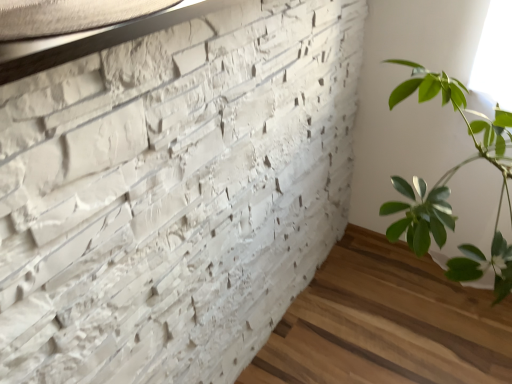
Question: Considering the relative sizes of white textured brickwork at upper left and matte white stone at upper left in the image provided, is white textured brickwork at upper left smaller than matte white stone at upper left?

Choices:
 (A) no
 (B) yes

Answer: (A)

Question: Is matte white stone at upper left surrounded by white textured brickwork at upper left?

Choices:
 (A) yes
 (B) no

Answer: (A)

Question: From a real-world perspective, is white textured brickwork at upper left physically below matte white stone at upper left?

Choices:
 (A) yes
 (B) no

Answer: (A)

Question: Considering the relative positions of white textured brickwork at upper left and matte white stone at upper left in the image provided, is white textured brickwork at upper left to the left of matte white stone at upper left from the viewer's perspective?

Choices:
 (A) no
 (B) yes

Answer: (A)

Question: Is the depth of white textured brickwork at upper left greater than that of matte white stone at upper left?

Choices:
 (A) yes
 (B) no

Answer: (B)

Question: From the image's perspective, is white textured brickwork at upper left on matte white stone at upper left?

Choices:
 (A) yes
 (B) no

Answer: (B)

Question: Is matte white stone at upper left taller than white textured brickwork at upper left?

Choices:
 (A) no
 (B) yes

Answer: (A)

Question: Is matte white stone at upper left positioned before white textured brickwork at upper left?

Choices:
 (A) no
 (B) yes

Answer: (A)

Question: From a real-world perspective, is matte white stone at upper left below white textured brickwork at upper left?

Choices:
 (A) no
 (B) yes

Answer: (A)

Question: Is matte white stone at upper left outside of white textured brickwork at upper left?

Choices:
 (A) yes
 (B) no

Answer: (B)

Question: Is matte white stone at upper left not near white textured brickwork at upper left?

Choices:
 (A) yes
 (B) no

Answer: (B)

Question: Is matte white stone at upper left at the right side of white textured brickwork at upper left?

Choices:
 (A) no
 (B) yes

Answer: (A)

Question: Considering their positions, is white textured brickwork at upper left located in front of or behind matte white stone at upper left?

Choices:
 (A) behind
 (B) front

Answer: (B)